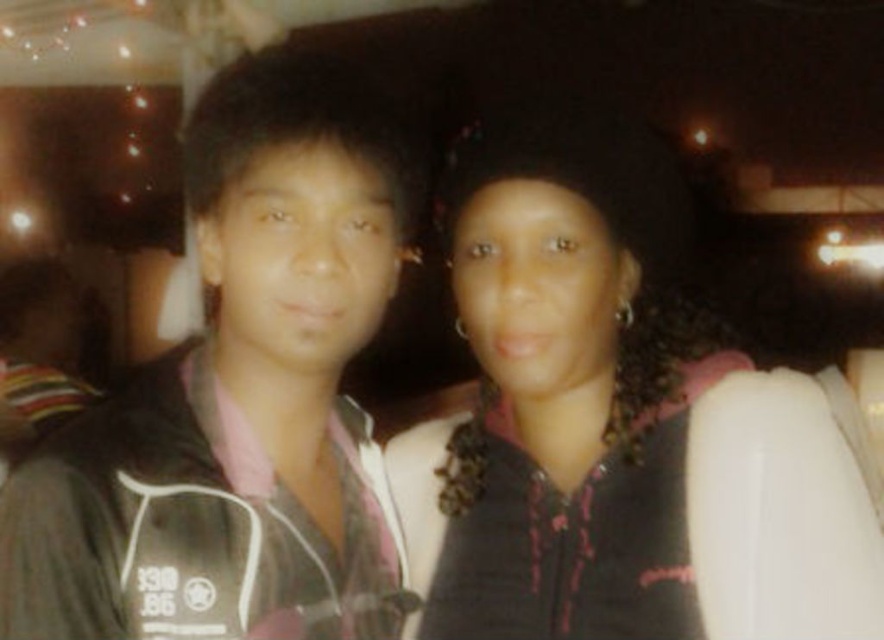
Is point (486, 397) farther from viewer compared to point (232, 596)?

Yes.

Who is more forward, (688, 301) or (286, 481)?

Point (286, 481) is in front.

Does point (621, 140) come closer to viewer compared to point (227, 150)?

No.

The image size is (884, 640). What are the coordinates of `black matte jacket at center` in the screenshot? It's located at (606, 416).